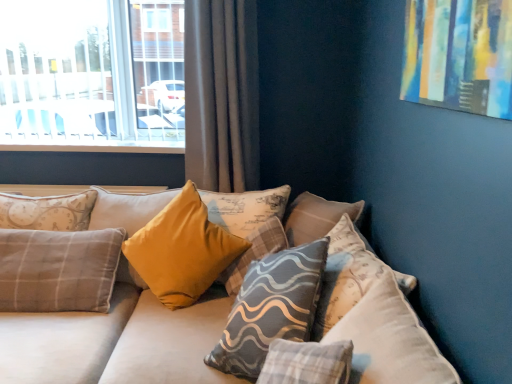
Question: Does clear glass window at upper left have a larger size compared to gray textured pillow at center, marked as the 2th pillow in a left-to-right arrangement?

Choices:
 (A) yes
 (B) no

Answer: (A)

Question: Does clear glass window at upper left have a greater width compared to gray textured pillow at center, the third pillow positioned from the right?

Choices:
 (A) no
 (B) yes

Answer: (A)

Question: Can gray textured pillow at center, marked as the 2th pillow in a left-to-right arrangement, be found inside clear glass window at upper left?

Choices:
 (A) yes
 (B) no

Answer: (B)

Question: Would you say clear glass window at upper left is outside gray textured pillow at center, the third pillow positioned from the right?

Choices:
 (A) yes
 (B) no

Answer: (A)

Question: Is the depth of clear glass window at upper left greater than that of gray textured pillow at center, the third pillow positioned from the right?

Choices:
 (A) no
 (B) yes

Answer: (B)

Question: Would you say gray textured pillow at center, marked as the 1th pillow in a right-to-left arrangement, is to the left or to the right of velvet beige couch at center in the picture?

Choices:
 (A) right
 (B) left

Answer: (A)

Question: Is gray textured pillow at center, acting as the fourth pillow starting from the left, situated inside velvet beige couch at center or outside?

Choices:
 (A) outside
 (B) inside

Answer: (B)

Question: Considering their positions, is gray textured pillow at center, marked as the 1th pillow in a right-to-left arrangement, located in front of or behind velvet beige couch at center?

Choices:
 (A) behind
 (B) front

Answer: (A)

Question: From a real-world perspective, relative to velvet beige couch at center, is gray textured pillow at center, acting as the fourth pillow starting from the left, vertically above or below?

Choices:
 (A) below
 (B) above

Answer: (B)

Question: Is clear glass window at upper left in front of or behind velvet mustard pillow at center, the second pillow positioned from the right, in the image?

Choices:
 (A) behind
 (B) front

Answer: (A)

Question: From a real-world perspective, relative to velvet mustard pillow at center, which is the third pillow in left-to-right order, is clear glass window at upper left vertically above or below?

Choices:
 (A) below
 (B) above

Answer: (B)

Question: From the image's perspective, is clear glass window at upper left located above or below velvet mustard pillow at center, which is the third pillow in left-to-right order?

Choices:
 (A) below
 (B) above

Answer: (B)

Question: From their relative heights in the image, would you say clear glass window at upper left is taller or shorter than velvet mustard pillow at center, the second pillow positioned from the right?

Choices:
 (A) tall
 (B) short

Answer: (A)

Question: Is gray fabric curtain at upper left in front of or behind velvet beige couch at center in the image?

Choices:
 (A) behind
 (B) front

Answer: (A)

Question: Is gray fabric curtain at upper left wider or thinner than velvet beige couch at center?

Choices:
 (A) wide
 (B) thin

Answer: (B)